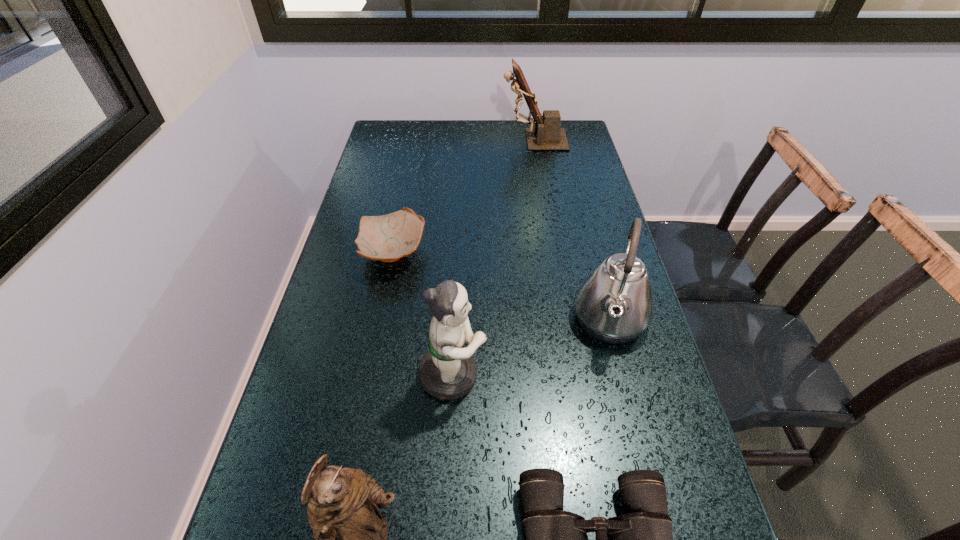
Find the location of `the rightmost figurine`. the rightmost figurine is located at coordinates (547, 135).

Where is `the farthest figurine`? The width and height of the screenshot is (960, 540). the farthest figurine is located at coordinates (547, 135).

Find the location of a particular element. the second nearest figurine is located at coordinates (448, 371).

This screenshot has width=960, height=540. I want to click on kettle, so click(614, 304).

This screenshot has width=960, height=540. Identify the location of pottery. (387, 238).

You are a GUI agent. You are given a task and a screenshot of the screen. Output one action in this format:
    pyautogui.click(x=<x>, y=<y>)
    Task: Click on the free space located 0.400m on the front-facing side of the farthest object
    The height and width of the screenshot is (540, 960).
    Given the screenshot: What is the action you would take?
    pyautogui.click(x=393, y=140)

Where is `free space located 0.170m on the front-facing side of the farthest object`? This screenshot has width=960, height=540. free space located 0.170m on the front-facing side of the farthest object is located at coordinates (455, 140).

Find the location of a particular element. This screenshot has width=960, height=540. free point located on the front-facing side of the farthest object is located at coordinates (482, 140).

Find the location of a particular element. free location located 0.130m on the front-facing side of the second nearest figurine is located at coordinates (547, 375).

You are a GUI agent. You are given a task and a screenshot of the screen. Output one action in this format:
    pyautogui.click(x=<x>, y=<y>)
    Task: Click on the vacant space located 0.150m on the front of the kettle
    
    Given the screenshot: What is the action you would take?
    pyautogui.click(x=636, y=423)